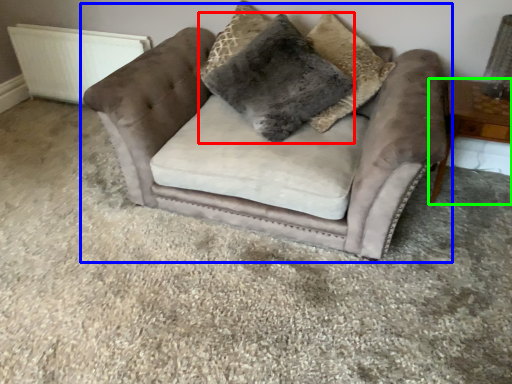
Question: Which is nearer to the pillow (highlighted by a red box)? chair (highlighted by a blue box) or table (highlighted by a green box).

Choices:
 (A) chair
 (B) table

Answer: (A)